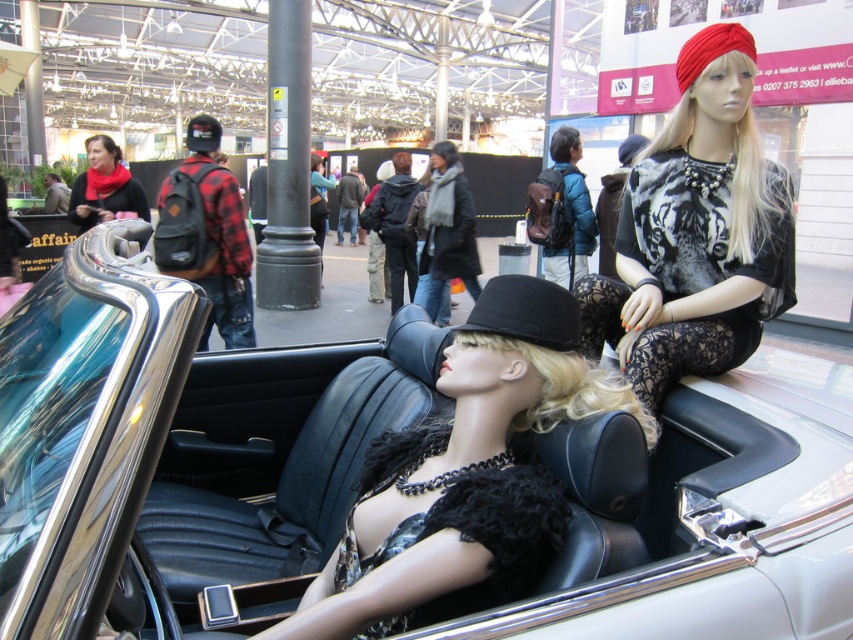
Can you confirm if black matte hat at center is positioned above black fabric hat at upper center?

Incorrect, black matte hat at center is not positioned above black fabric hat at upper center.

Can you confirm if black matte hat at center is bigger than black fabric hat at upper center?

Actually, black matte hat at center might be smaller than black fabric hat at upper center.

Which is behind, point (346, 557) or point (212, 128)?

The point (212, 128) is behind.

This screenshot has width=853, height=640. I want to click on black matte hat at center, so click(x=463, y=476).

Is white leather car at center below black felt hat at center?

Yes.

Between point (358, 384) and point (469, 316), which one is positioned behind?

The point (358, 384) is behind.

The height and width of the screenshot is (640, 853). I want to click on white leather car at center, so click(178, 429).

Does point (67, 216) come farther from viewer compared to point (88, 145)?

Yes.

Which is behind, point (114, 157) or point (108, 144)?

Positioned behind is point (114, 157).

Find the location of `matte red scarf at upper left`. matte red scarf at upper left is located at coordinates (103, 186).